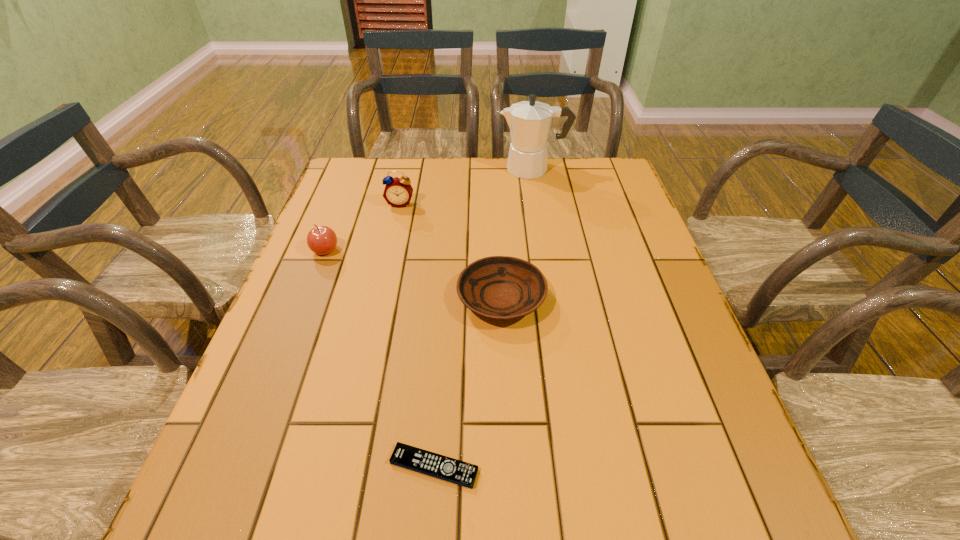
Locate an element on the screen. free space located at the spout of the farthest object is located at coordinates (377, 168).

Where is `vacant space located 0.190m at the spout of the farthest object`? vacant space located 0.190m at the spout of the farthest object is located at coordinates (442, 168).

At what (x,y) coordinates should I click in order to perform the action: click on free point located 0.050m at the spout of the farthest object. Please return your answer as a coordinate pair (x, y). Looking at the image, I should click on (484, 168).

At what (x,y) coordinates should I click in order to perform the action: click on vacant region located 0.240m on the front-facing side of the second tallest object. Please return your answer as a coordinate pair (x, y). Looking at the image, I should click on (387, 263).

Image resolution: width=960 pixels, height=540 pixels. Identify the location of vacant point located 0.260m on the right of the apple. pyautogui.click(x=438, y=251).

Where is `blank space located 0.130m on the left of the plate`? The image size is (960, 540). blank space located 0.130m on the left of the plate is located at coordinates (401, 298).

Identify the location of vacant space located on the back of the remote control. Image resolution: width=960 pixels, height=540 pixels. (441, 377).

You are a GUI agent. You are given a task and a screenshot of the screen. Output one action in this format:
    pyautogui.click(x=<x>, y=<y>)
    Task: Click on the object that is at the far edge
    The image size is (960, 540).
    Given the screenshot: What is the action you would take?
    pyautogui.click(x=529, y=121)

Find the location of a particular element. The height and width of the screenshot is (540, 960). object that is at the near edge is located at coordinates (455, 471).

Image resolution: width=960 pixels, height=540 pixels. In order to click on object that is at the left edge in this screenshot , I will do point(322,240).